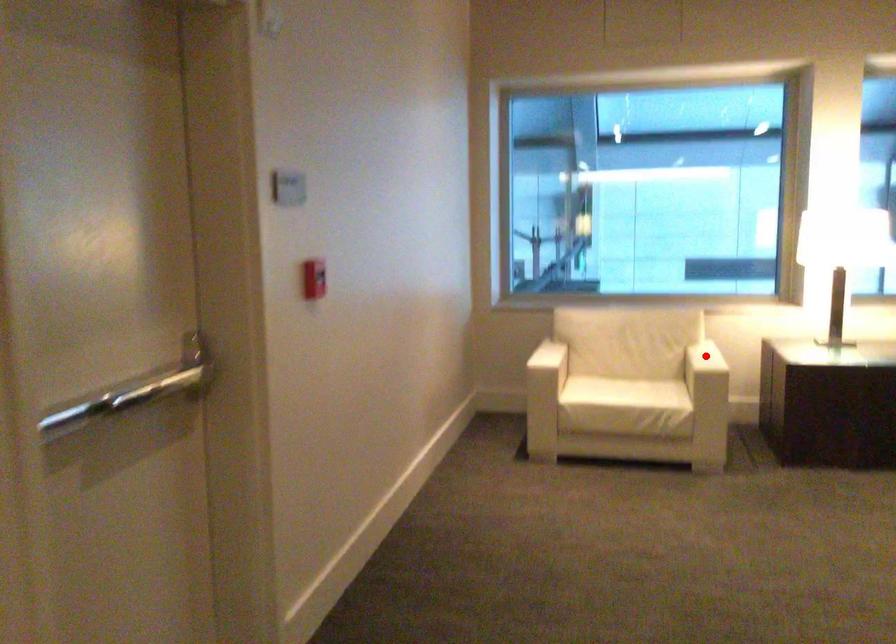
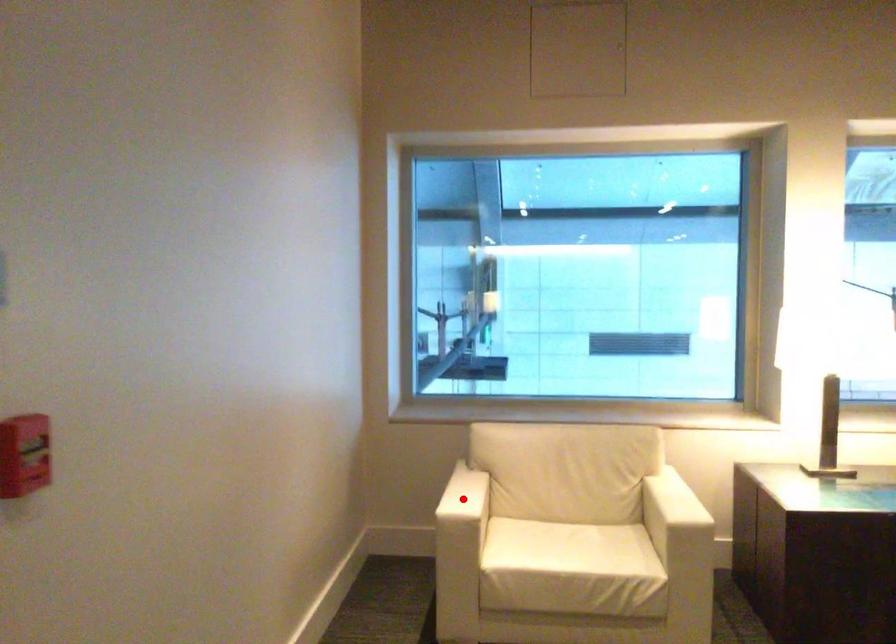
I am providing you with two images of the same scene from different viewpoints. A red point is marked on the first image and another point is marked on the second image. Do the highlighted points in image1 and image2 indicate the same real-world spot?

No